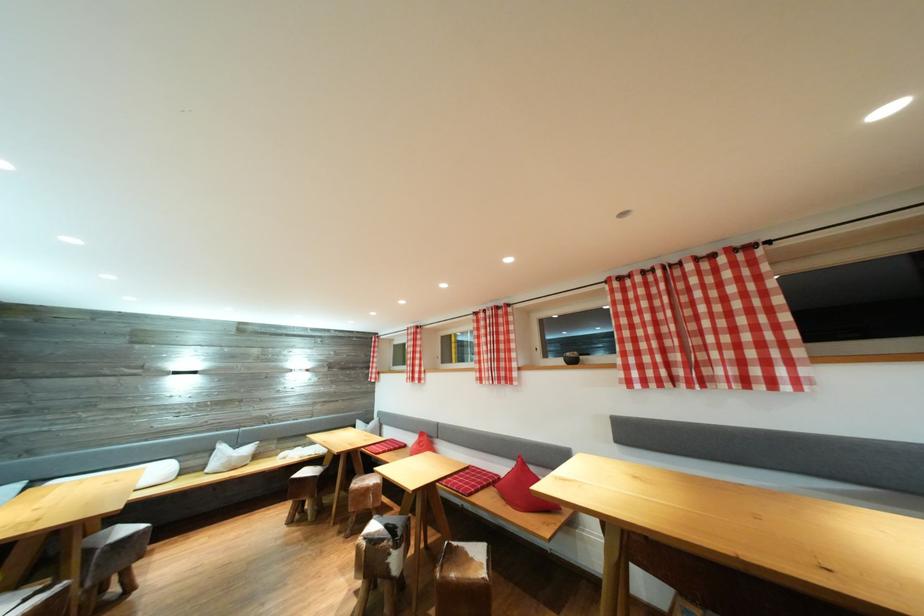
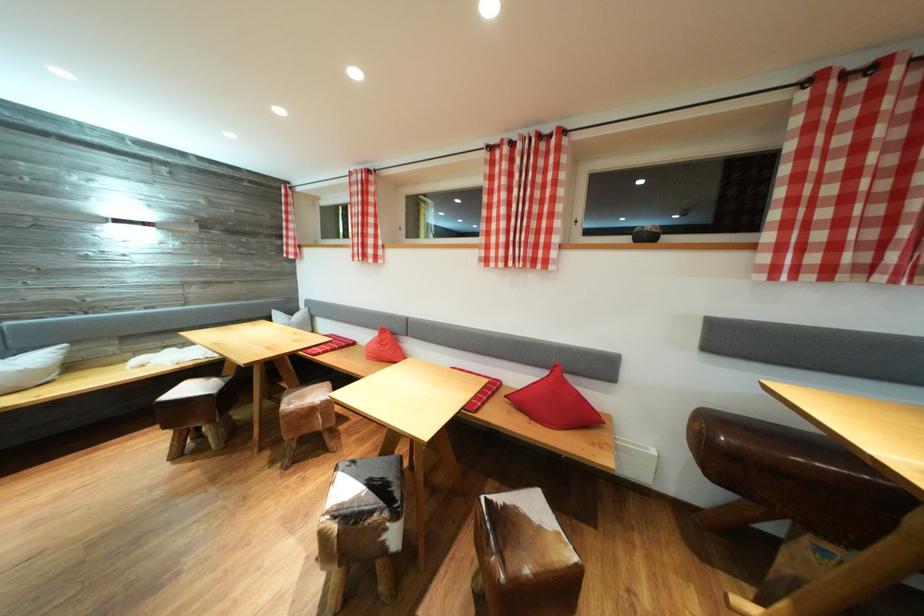
Locate, in the second image, the point that corresponds to point (487, 385) in the first image.

(492, 265)